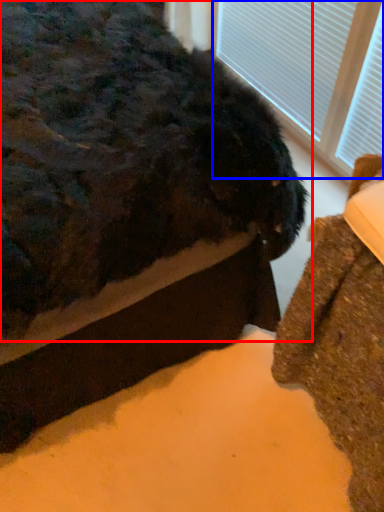
Question: Which of the following is the farthest to the observer, animal (highlighted by a red box) or bay window (highlighted by a blue box)?

Choices:
 (A) animal
 (B) bay window

Answer: (B)